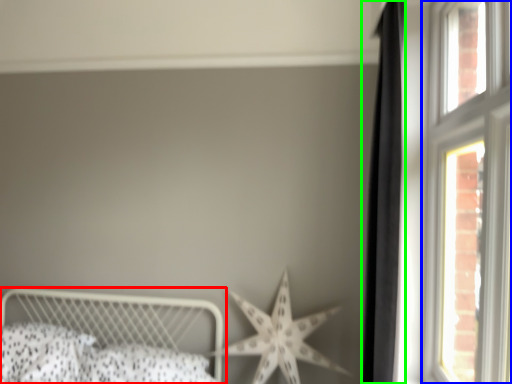
Question: Considering the real-world distances, which object is farthest from bed (highlighted by a red box)? window (highlighted by a blue box) or curtain (highlighted by a green box)?

Choices:
 (A) window
 (B) curtain

Answer: (A)